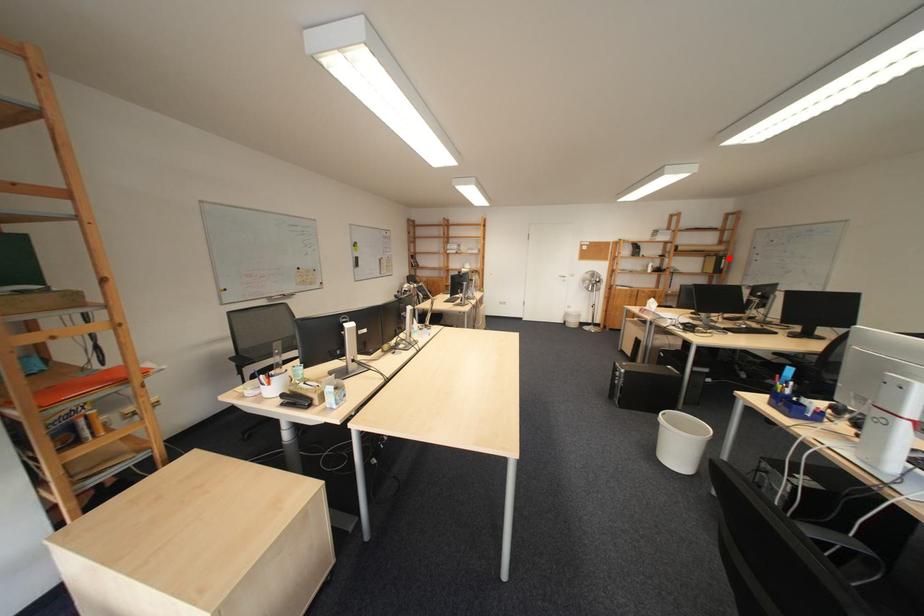
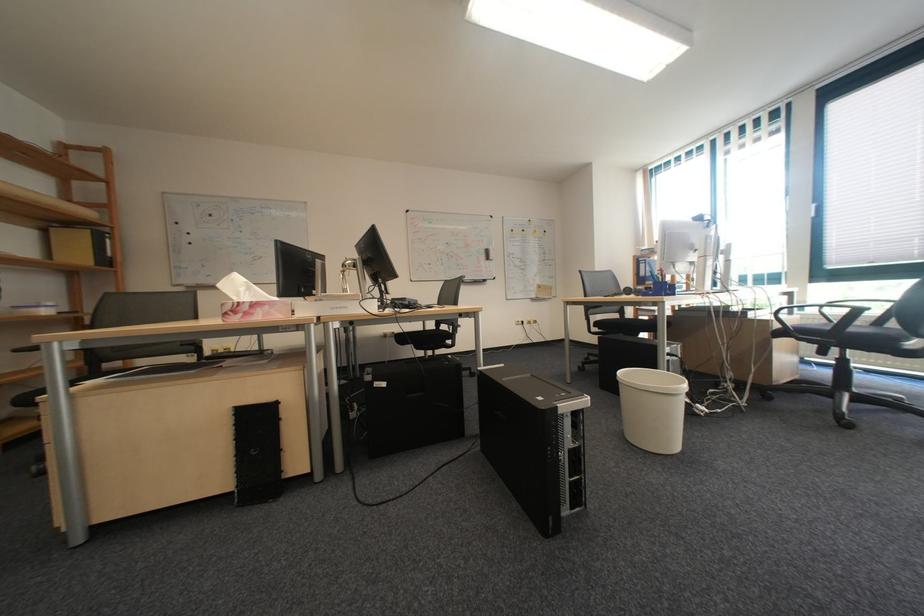
In the second image, find the point that corresponds to the highlighted location in the first image.

(103, 232)